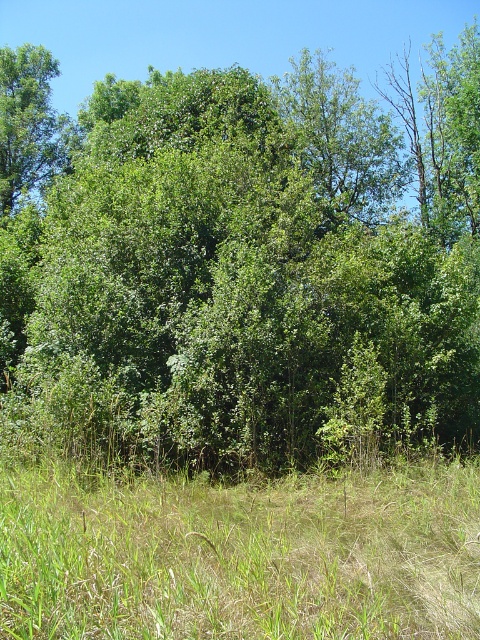
Consider the image. Is green grassy at lower center to the left of green leafy tree at upper left from the viewer's perspective?

No, green grassy at lower center is not to the left of green leafy tree at upper left.

Does point (32, 616) lie in front of point (24, 84)?

Yes, it is in front of point (24, 84).

You are a GUI agent. You are given a task and a screenshot of the screen. Output one action in this format:
    pyautogui.click(x=<x>, y=<y>)
    Task: Click on the green grassy at lower center
    This screenshot has width=480, height=640.
    Given the screenshot: What is the action you would take?
    pyautogui.click(x=241, y=557)

Is green leafy tree at center shorter than green grassy at lower center?

Incorrect, green leafy tree at center's height does not fall short of green grassy at lower center's.

Is the position of green leafy tree at center less distant than that of green grassy at lower center?

No, it is not.

You are a GUI agent. You are given a task and a screenshot of the screen. Output one action in this format:
    pyautogui.click(x=<x>, y=<y>)
    Task: Click on the green leafy tree at center
    This screenshot has width=480, height=640.
    Given the screenshot: What is the action you would take?
    pyautogui.click(x=240, y=264)

The height and width of the screenshot is (640, 480). I want to click on green leafy tree at center, so click(x=240, y=264).

Is green leafy tree at center shorter than green leafy tree at upper left?

No, green leafy tree at center is not shorter than green leafy tree at upper left.

Between green leafy tree at center and green leafy tree at upper left, which one appears on the right side from the viewer's perspective?

green leafy tree at center

Who is more forward, (465, 164) or (24, 116)?

Point (24, 116)

Locate an element on the screen. The image size is (480, 640). green leafy tree at center is located at coordinates (240, 264).